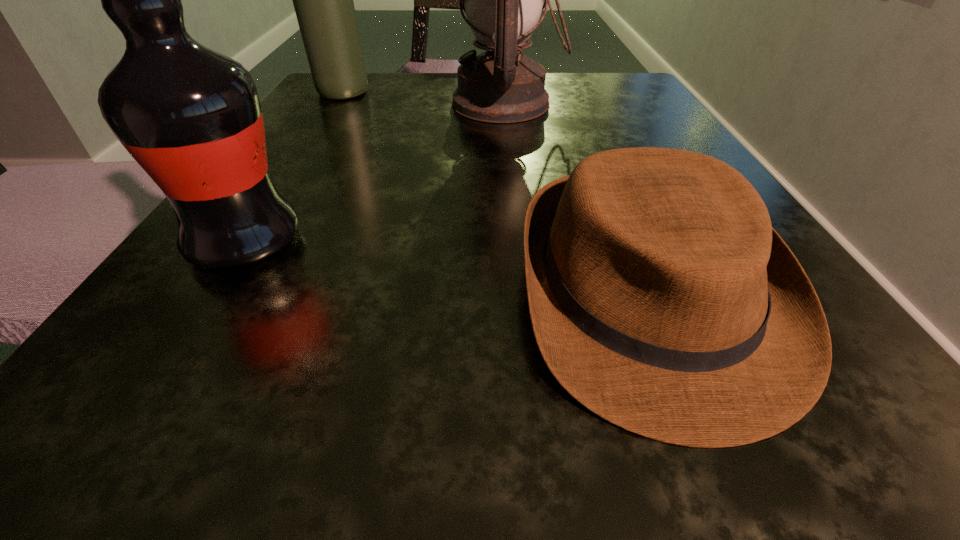
At what (x,y) coordinates should I click in order to perform the action: click on oil lamp. Please return your answer as a coordinate pair (x, y). The width and height of the screenshot is (960, 540). Looking at the image, I should click on (503, 0).

I want to click on the farther wine bottle, so click(x=323, y=0).

The image size is (960, 540). I want to click on the nearer wine bottle, so click(190, 116).

Identify the location of fedora. [x=661, y=298].

Identify the location of free region located on the left of the oil lamp. Image resolution: width=960 pixels, height=540 pixels. click(x=387, y=104).

Where is `vacant space located on the right of the farther wine bottle`? Image resolution: width=960 pixels, height=540 pixels. vacant space located on the right of the farther wine bottle is located at coordinates (411, 93).

You are a GUI agent. You are given a task and a screenshot of the screen. Output one action in this format:
    pyautogui.click(x=<x>, y=<y>)
    Task: Click on the vacant space located on the back of the nearer wine bottle
    This screenshot has height=540, width=960.
    Given the screenshot: What is the action you would take?
    pyautogui.click(x=313, y=138)

This screenshot has height=540, width=960. I want to click on oil lamp present at the far edge, so click(503, 0).

Identify the location of wine bottle positioned at the far edge. (323, 0).

You are a GUI agent. You are given a task and a screenshot of the screen. Output one action in this format:
    pyautogui.click(x=<x>, y=<y>)
    Task: Click on the object that is at the near edge
    
    Given the screenshot: What is the action you would take?
    pyautogui.click(x=661, y=298)